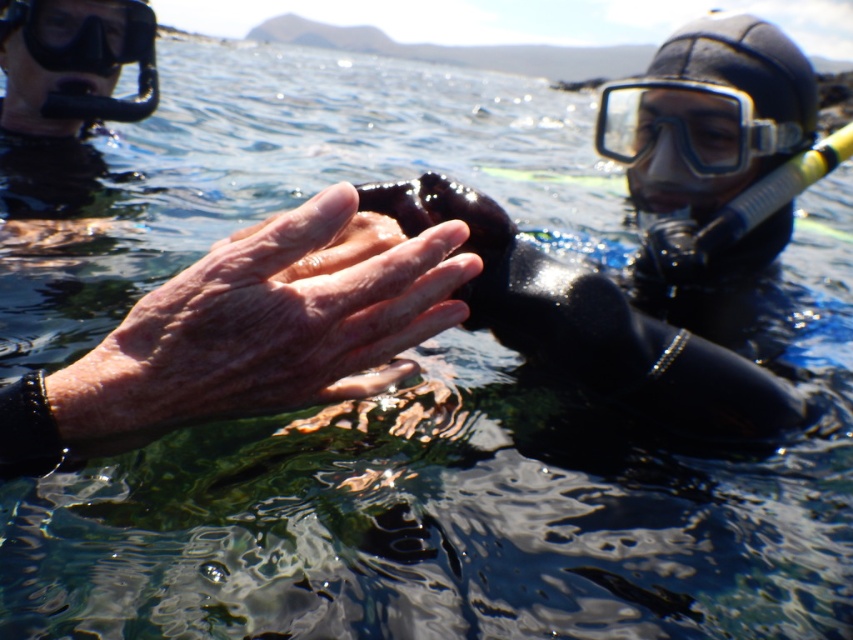
Who is more distant from viewer, (648,150) or (96,3)?

Positioned behind is point (96,3).

Between clear plastic goggles at upper right and black matte goggles at upper left, which one is positioned lower?

clear plastic goggles at upper right

The width and height of the screenshot is (853, 640). What do you see at coordinates (688, 125) in the screenshot?
I see `clear plastic goggles at upper right` at bounding box center [688, 125].

You are a GUI agent. You are given a task and a screenshot of the screen. Output one action in this format:
    pyautogui.click(x=<x>, y=<y>)
    Task: Click on the clear plastic goggles at upper right
    Image resolution: width=853 pixels, height=640 pixels.
    Given the screenshot: What is the action you would take?
    pyautogui.click(x=688, y=125)

Measure the distance between dry skin hand at center and camera.

dry skin hand at center and camera are 17.98 inches apart.

Is dry skin hand at center positioned before clear plastic goggles at upper right?

Yes, dry skin hand at center is in front of clear plastic goggles at upper right.

Which is in front, point (131, 320) or point (699, 92)?

Point (131, 320)

Image resolution: width=853 pixels, height=640 pixels. Identify the location of dry skin hand at center. (265, 324).

Consider the image. Which is above, dry skin hand at center or black matte goggles at upper left?

black matte goggles at upper left

Who is more distant from viewer, (160,298) or (131,35)?

Positioned behind is point (131,35).

Between point (235, 236) and point (111, 3), which one is positioned in front?

Positioned in front is point (235, 236).

Where is `dry skin hand at center`? dry skin hand at center is located at coordinates (265, 324).